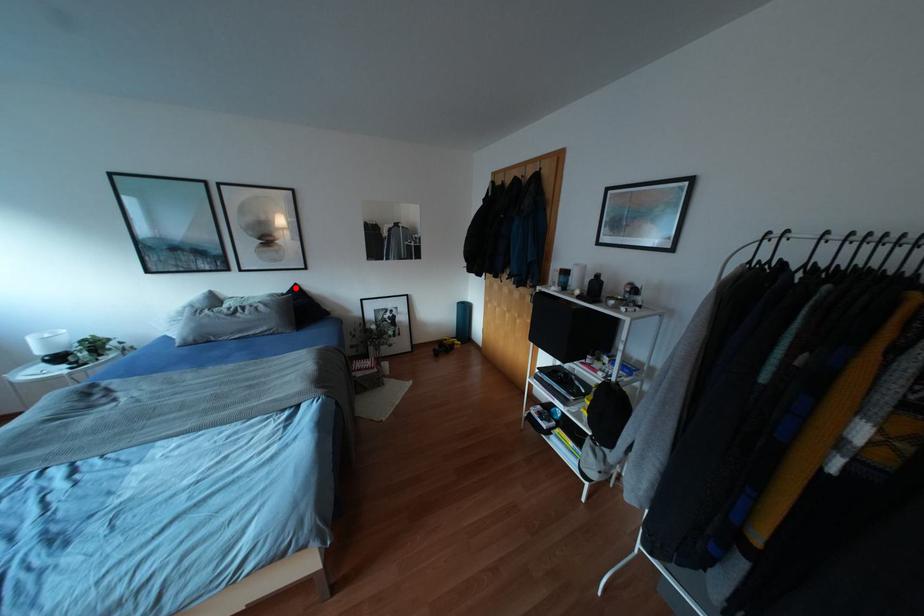
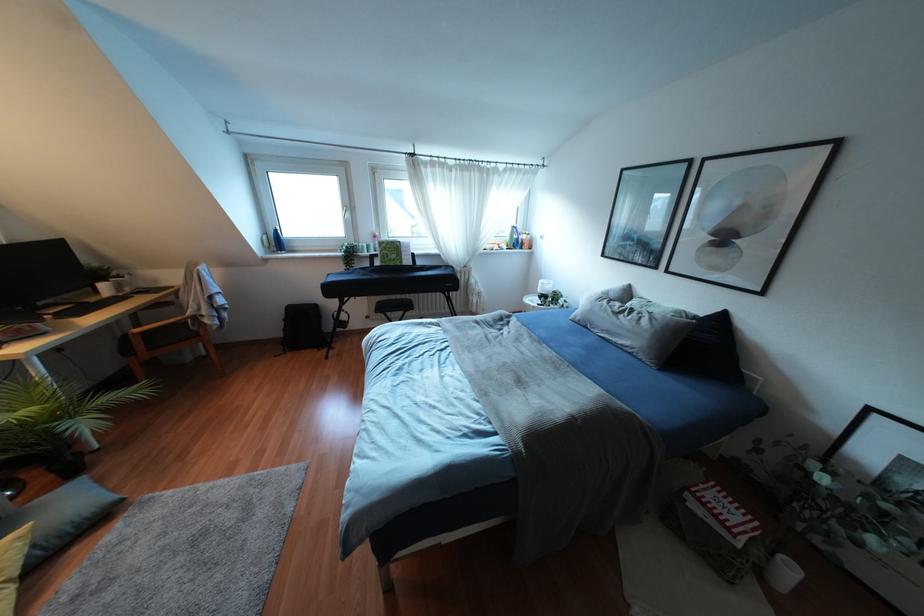
Where in the second image is the point corresponding to the highlighted location from the first image?

(722, 317)